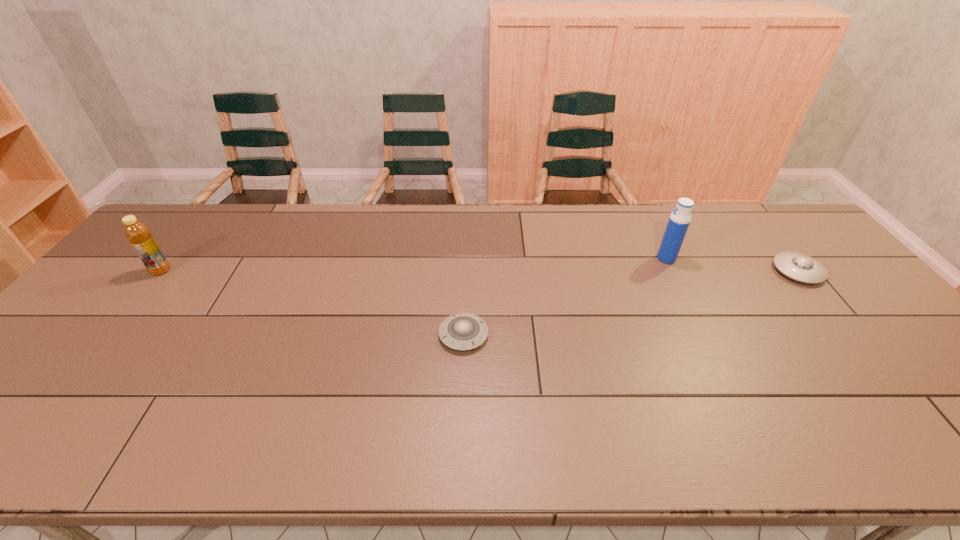
Image resolution: width=960 pixels, height=540 pixels. Identify the location of object positioned at the left edge. (137, 233).

Locate an element on the screen. This screenshot has width=960, height=540. object located at the right edge is located at coordinates (800, 267).

Locate an element on the screen. This screenshot has height=540, width=960. blank area at the far edge is located at coordinates (527, 231).

Locate an element on the screen. Image resolution: width=960 pixels, height=540 pixels. vacant space at the near edge is located at coordinates (719, 441).

Image resolution: width=960 pixels, height=540 pixels. What are the coordinates of `free region at the right edge of the desktop` in the screenshot? It's located at (851, 332).

Image resolution: width=960 pixels, height=540 pixels. Identify the location of empty space that is in between the rightmost object and the bottle. (479, 271).

Where is `vacant region between the bottle and the second object from right to left`? The height and width of the screenshot is (540, 960). vacant region between the bottle and the second object from right to left is located at coordinates (414, 265).

Identify the location of free spot between the leftmost object and the taller saucer. The width and height of the screenshot is (960, 540). (479, 271).

Image resolution: width=960 pixels, height=540 pixels. Find the location of `blank region between the left saucer and the second object from right to left`. blank region between the left saucer and the second object from right to left is located at coordinates (564, 296).

At what (x,y) coordinates should I click in order to perform the action: click on free space between the shortest object and the third object from left to right. Please return your answer as a coordinate pair (x, y). Looking at the image, I should click on (564, 296).